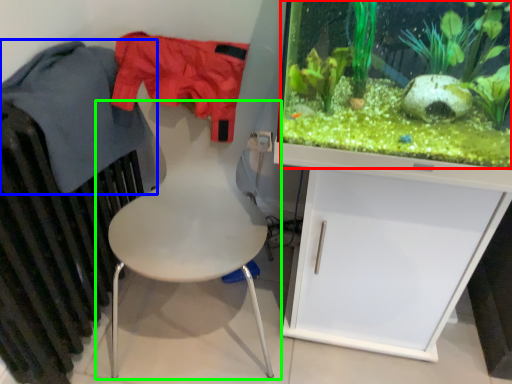
Question: Based on their relative distances, which object is nearer to plant (highlighted by a red box)? Choose from clothing (highlighted by a blue box) and chair (highlighted by a green box).

Choices:
 (A) clothing
 (B) chair

Answer: (B)